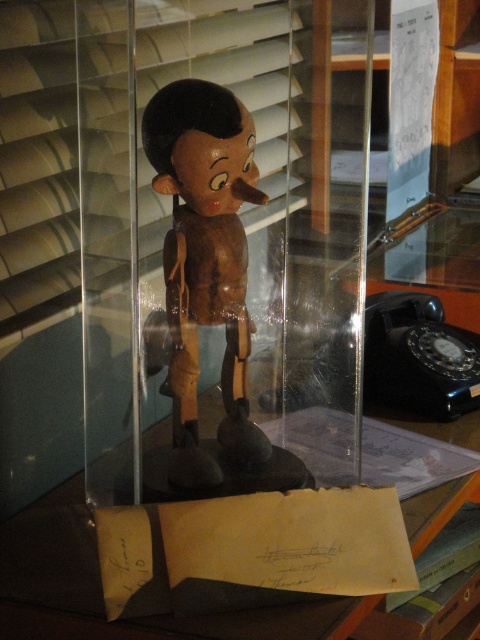
You are a museum curator trying to determine if a new display case can accommodate both the wooden figurine at center and the transparent plastic table at center. The display case has limited space. Based on the image, which object takes up more space and would require more consideration for placement?

The wooden figurine at center occupies less space than the transparent plastic table at center, so the transparent plastic table at center requires more consideration for placement due to its larger size.

You are a delivery person who needs to place a small package on the transparent plastic table at center. The package is 30 centimeters wide. Can you fit it on the table without moving the wooden figurine at center?

The wooden figurine at center and transparent plastic table at center are 31.47 centimeters apart from each other. Since the package is 30 centimeters wide, it can be placed on the transparent plastic table at center without needing to move the wooden figurine at center as there is enough space between them.